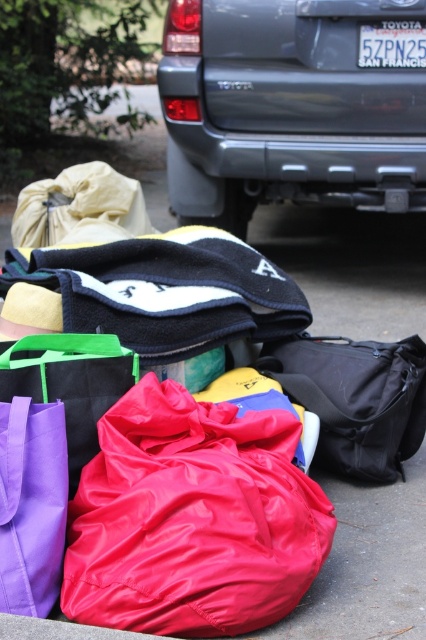
You need to load the shiny red sleeping bag at center into the trunk of the gray matte suv at center. Based on their sizes, will the sleeping bag fit vertically inside the SUV?

The gray matte suv at center is taller than the shiny red sleeping bag at center, so the sleeping bag should fit vertically inside the SUV.

You are trying to locate the shiny red sleeping bag at center in the image. According to the coordinates provided, where exactly is it positioned?

The shiny red sleeping bag at center is positioned at coordinates point (192, 518).

You are packing for a camping trip and see the shiny red sleeping bag at center and the black matte duffel bag at center. Which one is positioned to the left?

The shiny red sleeping bag at center is positioned to the left of the black matte duffel bag at center.